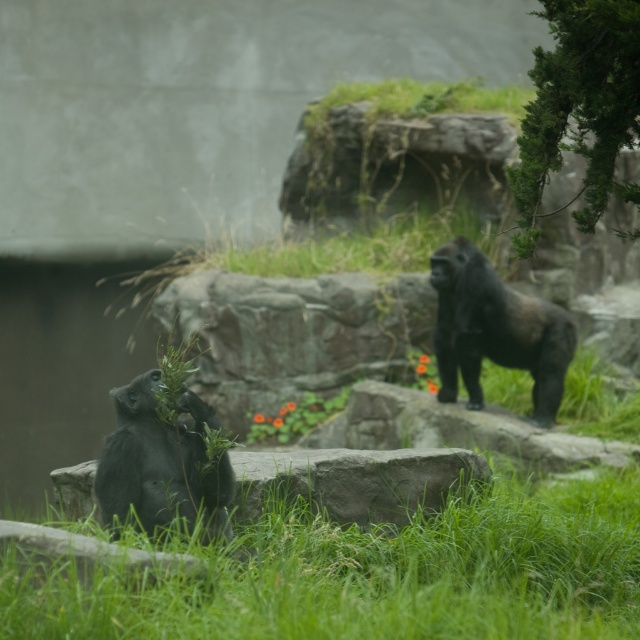
You are a zookeeper who needs to place a feeding tray between the green textured bush at upper right and the shiny black ape at lower left. Based on their positions, where should you place the feeding tray?

The feeding tray should be placed between the green textured bush at upper right and the shiny black ape at lower left, to the right of the shiny black ape at lower left since the green textured bush at upper right is positioned to the right of it.

You are a zookeeper trying to place a new feeding station in the enclosure. The feeding station requires a space larger than the shiny black ape at lower left. Can the green textured bush at upper right accommodate the feeding station?

The green textured bush at upper right is larger in size than the shiny black ape at lower left, so yes, the feeding station can be placed there as it meets the size requirement.

You are a zookeeper planning to place a new feeding station in the enclosure. The feeding station requires a flat surface that can accommodate its base. Given the scene, which object between the green grass at lower center and the gray rock at center would be more suitable for placing the feeding station?

The gray rock at center is more suitable for placing the feeding station because the green grass at lower center is larger in size but the rock provides a solid, flat surface needed for the base of the feeding station.